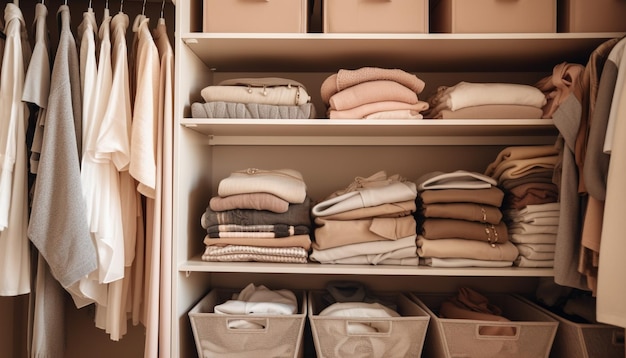
The width and height of the screenshot is (626, 358). Find the location of `baskets full of clothes`. baskets full of clothes is located at coordinates 254,344, 352,339, 461,335, 598,344.